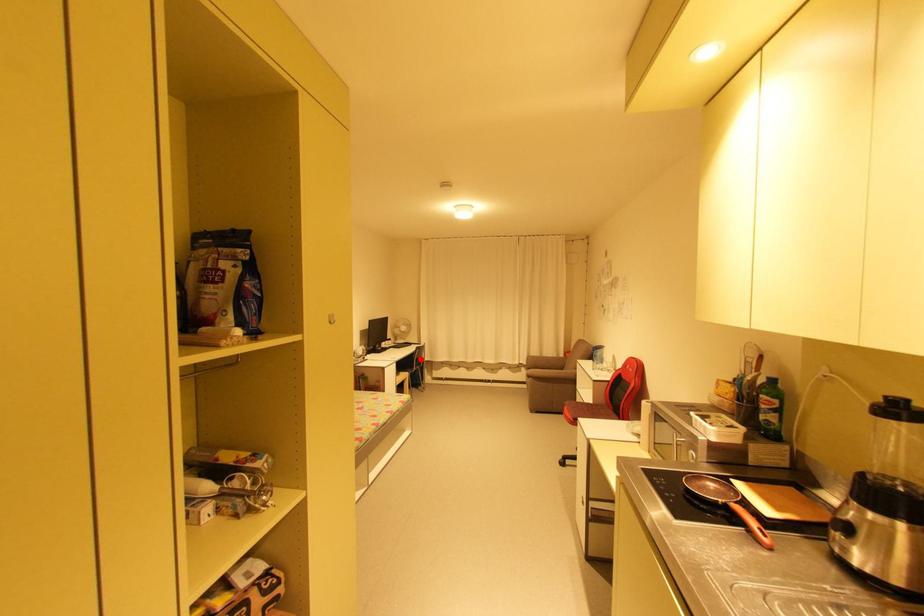
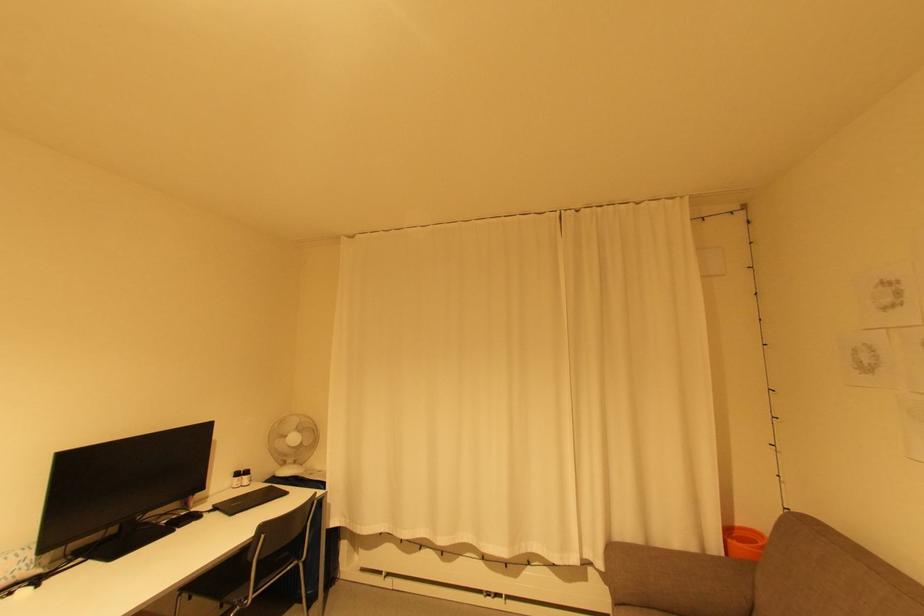
Locate, in the second image, the point that corresponds to the highlighted location in the first image.

(262, 562)